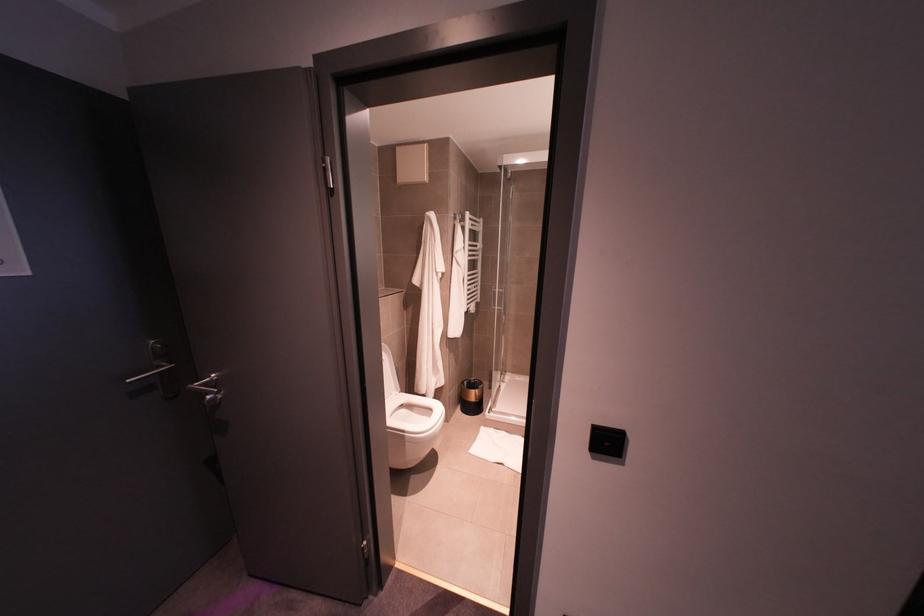
Where is `black keycard slot`? The width and height of the screenshot is (924, 616). black keycard slot is located at coordinates (606, 440).